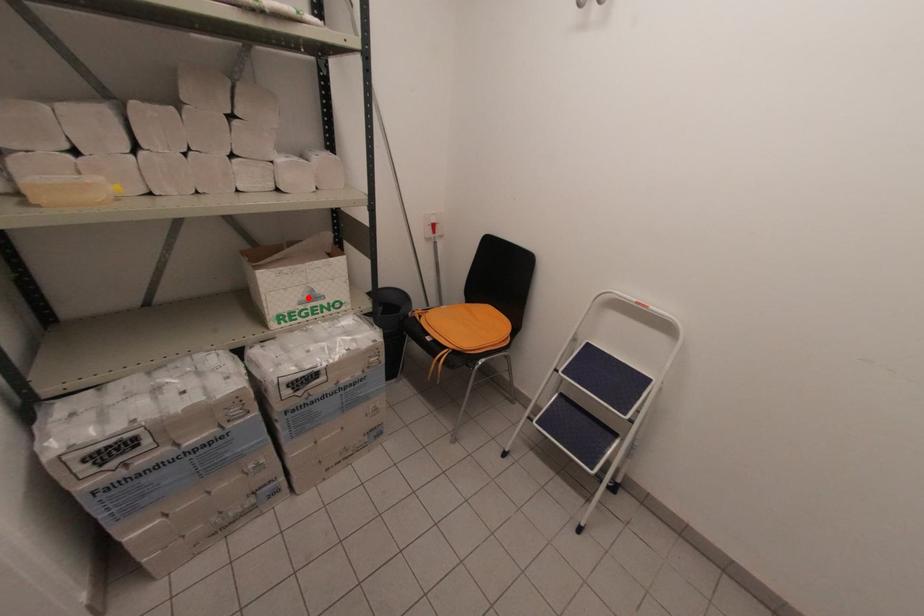
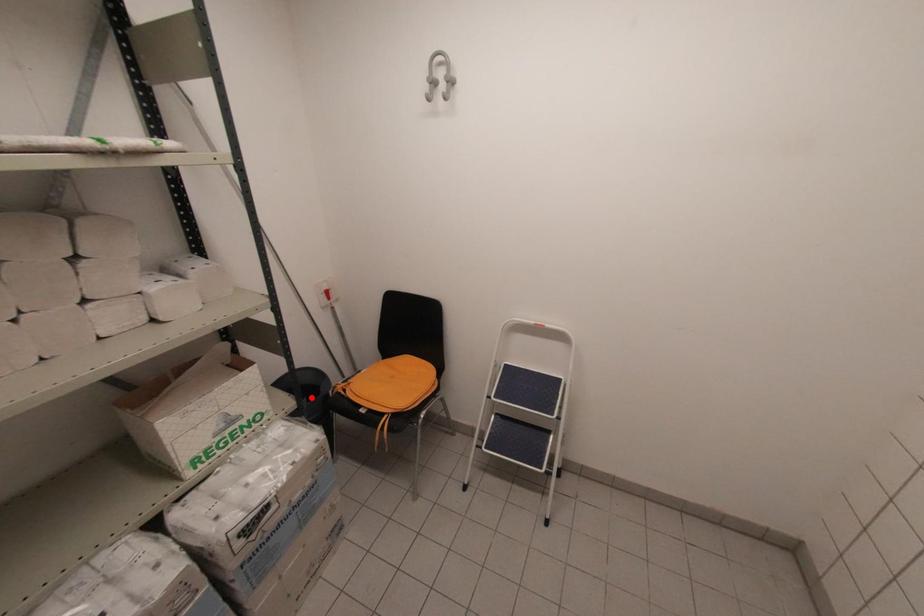
I am providing you with two images of the same scene from different viewpoints. A red point is marked on the first image and another point is marked on the second image. Are the points marked in image1 and image2 representing the same 3D position?

No